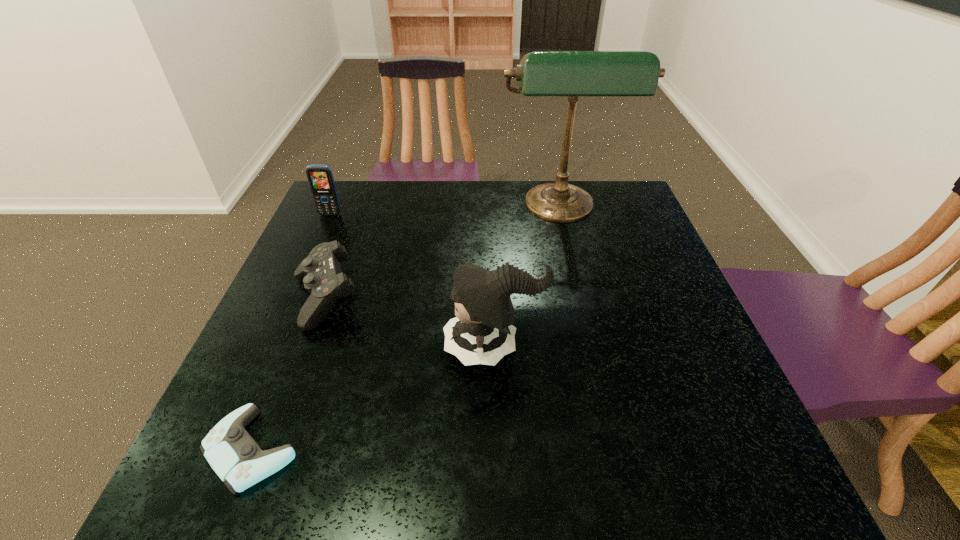
This screenshot has width=960, height=540. Find the location of `table lamp`. table lamp is located at coordinates (541, 73).

Find the location of a particular element. Image resolution: width=960 pixels, height=540 pixels. the fourth shortest object is located at coordinates (482, 332).

Where is `cellular telephone`? This screenshot has width=960, height=540. cellular telephone is located at coordinates point(320,177).

Identify the location of the farther control. (321, 273).

Identify the location of the fourth tallest object. (321, 273).

In order to click on the nearest object in this screenshot , I will do `click(233, 454)`.

This screenshot has width=960, height=540. In order to click on the shortest object in this screenshot , I will do `click(233, 454)`.

The image size is (960, 540). I want to click on vacant space located 0.060m above the green lampshade of the table lamp, so click(x=570, y=250).

You are a GUI agent. You are given a task and a screenshot of the screen. Output one action in this format:
    pyautogui.click(x=<x>, y=<y>)
    Task: Click on the free spot located at the face of the fourth shortest object
    The width and height of the screenshot is (960, 540).
    Given the screenshot: What is the action you would take?
    pyautogui.click(x=368, y=347)

The width and height of the screenshot is (960, 540). In order to click on vacant area situated at the face of the fourth shortest object in this screenshot , I will do `click(334, 347)`.